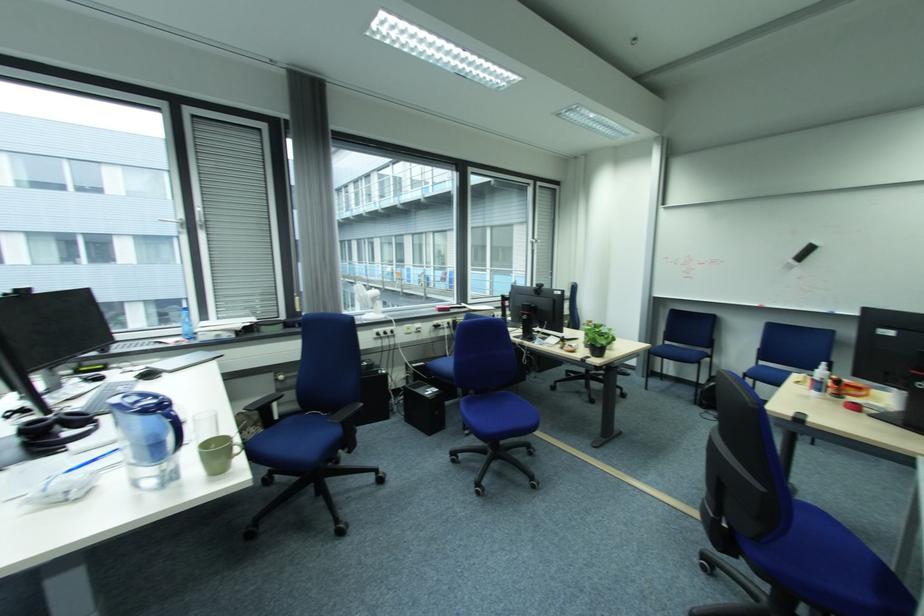
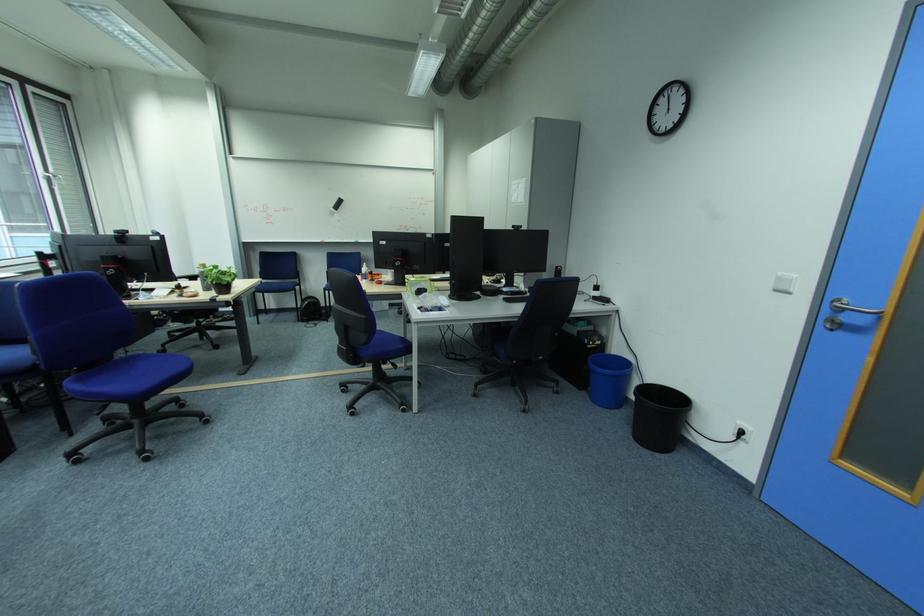
Locate, in the second image, the point that corresponds to [599,344] in the first image.

(224, 284)